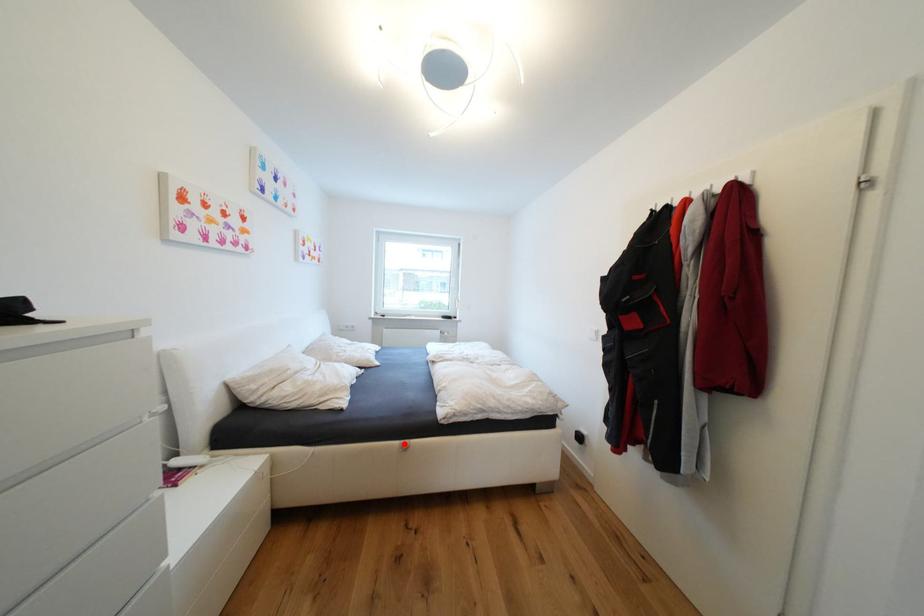
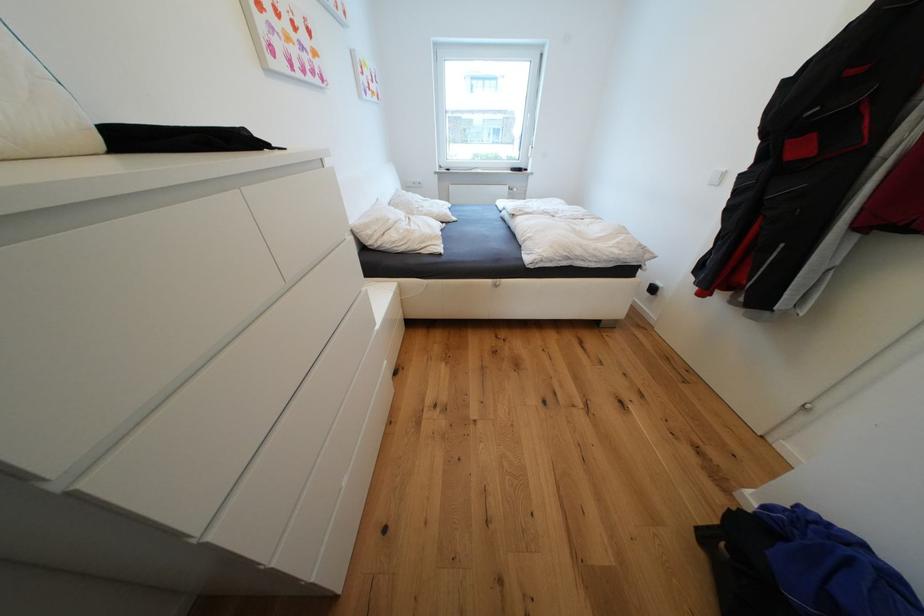
The point at the highlighted location is marked in the first image. Where is the corresponding point in the second image?

(496, 282)